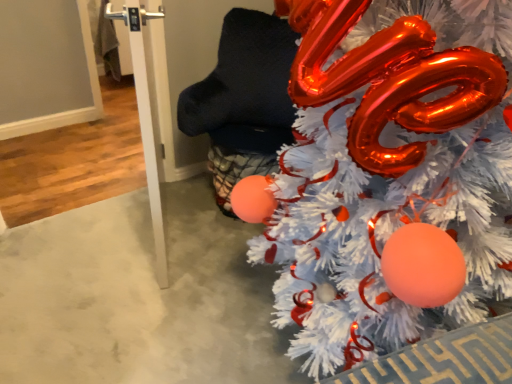
This screenshot has width=512, height=384. What do you see at coordinates (147, 119) in the screenshot?
I see `white glossy door handle at left` at bounding box center [147, 119].

Where is `white glossy door handle at left`? white glossy door handle at left is located at coordinates (147, 119).

Describe the element at coordinates (390, 176) in the screenshot. The image size is (512, 384). I see `white fluffy christmas tree at right` at that location.

Find the location of `white fluffy christmas tree at right`. white fluffy christmas tree at right is located at coordinates (390, 176).

Measure the distance between white fluffy christmas tree at right and camera.

A distance of 27.50 inches exists between white fluffy christmas tree at right and camera.

This screenshot has height=384, width=512. Identify the location of white glossy door handle at left. (147, 119).

Is white glossy door handle at left to the left of white fluffy christmas tree at right from the viewer's perspective?

Yes.

Is white glossy door handle at left closer to camera compared to white fluffy christmas tree at right?

No, it is not.

Which is closer, (x=120, y=11) or (x=279, y=263)?

The point (x=120, y=11) is closer.

From the image's perspective, which one is positioned lower, white glossy door handle at left or white fluffy christmas tree at right?

From the image's view, white fluffy christmas tree at right is below.

From a real-world perspective, is white glossy door handle at left on white fluffy christmas tree at right?

No, from a real-world perspective, white glossy door handle at left is not on top of white fluffy christmas tree at right.

Between white glossy door handle at left and white fluffy christmas tree at right, which one has larger width?

white fluffy christmas tree at right.

Who is taller, white glossy door handle at left or white fluffy christmas tree at right?

Standing taller between the two is white fluffy christmas tree at right.

Based on their sizes in the image, would you say white glossy door handle at left is bigger or smaller than white fluffy christmas tree at right?

white glossy door handle at left is smaller than white fluffy christmas tree at right.

Is white glossy door handle at left located outside white fluffy christmas tree at right?

Yes.

Does white glossy door handle at left touch white fluffy christmas tree at right?

They are not placed beside each other.

Is white glossy door handle at left turned away from white fluffy christmas tree at right?

Yes, white fluffy christmas tree at right is at the back of white glossy door handle at left.

Measure the distance between white glossy door handle at left and white fluffy christmas tree at right.

The distance of white glossy door handle at left from white fluffy christmas tree at right is 25.82 inches.

The width and height of the screenshot is (512, 384). Identify the location of christmas tree in front of the white glossy door handle at left. (390, 176).

Between white fluffy christmas tree at right and white glossy door handle at left, which one appears on the left side from the viewer's perspective?

white glossy door handle at left is more to the left.

Considering their positions, is white fluffy christmas tree at right located in front of or behind white glossy door handle at left?

In the image, white fluffy christmas tree at right appears in front of white glossy door handle at left.

Is point (332, 73) in front of point (148, 178)?

Yes, it is in front of point (148, 178).

From the image's perspective, would you say white fluffy christmas tree at right is positioned over white glossy door handle at left?

Actually, white fluffy christmas tree at right appears below white glossy door handle at left in the image.

From a real-world perspective, which is physically above, white fluffy christmas tree at right or white glossy door handle at left?

In real-world perspective, white fluffy christmas tree at right is above.

Can you confirm if white fluffy christmas tree at right is thinner than white glossy door handle at left?

In fact, white fluffy christmas tree at right might be wider than white glossy door handle at left.

Is white fluffy christmas tree at right taller than white glossy door handle at left?

Correct, white fluffy christmas tree at right is much taller as white glossy door handle at left.

In the scene shown: In terms of size, does white fluffy christmas tree at right appear bigger or smaller than white glossy door handle at left?

Clearly, white fluffy christmas tree at right is larger in size than white glossy door handle at left.

Would you say white fluffy christmas tree at right is outside white glossy door handle at left?

Yes, white fluffy christmas tree at right is outside of white glossy door handle at left.

Is there a large distance between white fluffy christmas tree at right and white glossy door handle at left?

Actually, white fluffy christmas tree at right and white glossy door handle at left are a little close together.

Is white fluffy christmas tree at right facing away from white glossy door handle at left?

white fluffy christmas tree at right is not turned away from white glossy door handle at left.

This screenshot has height=384, width=512. Identify the location of christmas tree below the white glossy door handle at left (from the image's perspective). (390, 176).

Where is `pole above the white fluffy christmas tree at right (from the image's perspective)`? pole above the white fluffy christmas tree at right (from the image's perspective) is located at coordinates (147, 119).

This screenshot has height=384, width=512. What are the coordinates of `christmas tree located below the white glossy door handle at left (from the image's perspective)` in the screenshot? It's located at (390, 176).